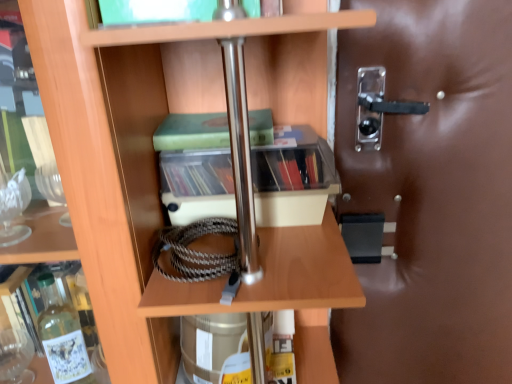
Measure the distance between clear plastic storage at center and camera.

clear plastic storage at center is 29.53 inches from camera.

The height and width of the screenshot is (384, 512). In order to click on clear plastic storage at center in this screenshot , I will do `click(293, 178)`.

Where is `wooden shelf at center`? This screenshot has height=384, width=512. wooden shelf at center is located at coordinates (106, 173).

Where is `transparent plastic handle at right`? This screenshot has height=384, width=512. transparent plastic handle at right is located at coordinates (431, 195).

Is clear plastic storage at center facing towards transparent plastic handle at right?

No, clear plastic storage at center is not turned towards transparent plastic handle at right.

Is clear plastic storage at center shorter than transparent plastic handle at right?

Correct, clear plastic storage at center is not as tall as transparent plastic handle at right.

In terms of width, does clear plastic storage at center look wider or thinner when compared to transparent plastic handle at right?

clear plastic storage at center is wider than transparent plastic handle at right.

Would you say clear plastic storage at center is outside transparent plastic handle at right?

Yes, clear plastic storage at center is outside of transparent plastic handle at right.

Considering the relative sizes of wooden shelf at center and green matte book at center in the image provided, is wooden shelf at center taller than green matte book at center?

Yes, wooden shelf at center is taller than green matte book at center.

Which is farther from the camera, (57, 106) or (225, 127)?

The point (225, 127) is more distant.

From the image's perspective, is wooden shelf at center above or below green matte book at center?

Clearly, from the image's perspective, wooden shelf at center is below green matte book at center.

Does wooden shelf at center appear on the right side of green matte book at center?

In fact, wooden shelf at center is to the left of green matte book at center.

Looking at the image, does transparent plastic handle at right seem bigger or smaller compared to green matte book at center?

transparent plastic handle at right is bigger than green matte book at center.

Where is `paperback book lying in front of the transparent plastic handle at right`? Image resolution: width=512 pixels, height=384 pixels. paperback book lying in front of the transparent plastic handle at right is located at coordinates (192, 132).

Does point (340, 71) come farther from viewer compared to point (221, 120)?

Yes, point (340, 71) is behind point (221, 120).

How different are the orientations of transparent plastic handle at right and green matte book at center in degrees?

The angle between the facing direction of transparent plastic handle at right and the facing direction of green matte book at center is 0.103 degrees.

Which of these two, wooden shelf at center or transparent plastic handle at right, is bigger?

wooden shelf at center.

Locate an element on the screen. shelf above the transparent plastic handle at right (from a real-world perspective) is located at coordinates (106, 173).

Between wooden shelf at center and transparent plastic handle at right, which one appears on the left side from the viewer's perspective?

From the viewer's perspective, wooden shelf at center appears more on the left side.

Is wooden shelf at center taller or shorter than transparent plastic handle at right?

Clearly, wooden shelf at center is shorter compared to transparent plastic handle at right.

Can you tell me how much transparent plastic handle at right and wooden shelf at center differ in facing direction?

0.178 degrees.

Is transparent plastic handle at right facing away from wooden shelf at center?

transparent plastic handle at right is not turned away from wooden shelf at center.

From the image's perspective, which one is positioned higher, transparent plastic handle at right or wooden shelf at center?

transparent plastic handle at right, from the image's perspective.

Is clear plastic storage at center oriented towards green matte book at center?

No, clear plastic storage at center is not facing towards green matte book at center.

Is point (210, 176) behind point (210, 143)?

That is True.

Can you tell me how much clear plastic storage at center and green matte book at center differ in facing direction?

They differ by 0.416 degrees in their facing directions.

Is clear plastic storage at center far away from green matte book at center?

No, clear plastic storage at center is in close proximity to green matte book at center.

Which of these two, wooden shelf at center or clear plastic storage at center, is thinner?

clear plastic storage at center is thinner.

At what (x,y) coordinates should I click in order to perform the action: click on cabinetry behind the wooden shelf at center. Please return your answer as a coordinate pair (x, y). Looking at the image, I should click on (293, 178).

Between wooden shelf at center and clear plastic storage at center, which one has smaller size?

With smaller size is clear plastic storage at center.

This screenshot has width=512, height=384. I want to click on cabinetry on the left of transparent plastic handle at right, so click(x=293, y=178).

At what (x,y) coordinates should I click in order to perform the action: click on shelf lying below the green matte book at center (from the image's perspective). Please return your answer as a coordinate pair (x, y). The height and width of the screenshot is (384, 512). Looking at the image, I should click on (106, 173).

Looking at the image, which one is located further to green matte book at center, transparent plastic handle at right or wooden shelf at center?

Answer: Among the two, transparent plastic handle at right is located further to green matte book at center.

Considering their positions, is transparent plastic handle at right positioned further to clear plastic storage at center than wooden shelf at center?

transparent plastic handle at right lies further to clear plastic storage at center than the other object.

Based on their spatial positions, is clear plastic storage at center or transparent plastic handle at right closer to green matte book at center?

Based on the image, clear plastic storage at center appears to be nearer to green matte book at center.

Considering their positions, is clear plastic storage at center positioned further to transparent plastic handle at right than wooden shelf at center?

wooden shelf at center is positioned further to the anchor transparent plastic handle at right.

Looking at the image, which one is located closer to wooden shelf at center, green matte book at center or transparent plastic handle at right?

green matte book at center is closer to wooden shelf at center.

Which object lies further to the anchor point green matte book at center, transparent plastic handle at right or clear plastic storage at center?

Among the two, transparent plastic handle at right is located further to green matte book at center.

Which object lies nearer to the anchor point wooden shelf at center, clear plastic storage at center or transparent plastic handle at right?

clear plastic storage at center.

From the image, which object appears to be nearer to transparent plastic handle at right, clear plastic storage at center or green matte book at center?

Based on the image, clear plastic storage at center appears to be nearer to transparent plastic handle at right.

Locate an element on the screen. paperback book situated between wooden shelf at center and transparent plastic handle at right from left to right is located at coordinates (192, 132).

Where is `cabinetry located between green matte book at center and transparent plastic handle at right in the left-right direction`? The height and width of the screenshot is (384, 512). cabinetry located between green matte book at center and transparent plastic handle at right in the left-right direction is located at coordinates (293, 178).

Where is `cabinetry between wooden shelf at center and transparent plastic handle at right in the horizontal direction`? cabinetry between wooden shelf at center and transparent plastic handle at right in the horizontal direction is located at coordinates (293, 178).

Image resolution: width=512 pixels, height=384 pixels. Identify the location of paperback book positioned between wooden shelf at center and clear plastic storage at center from near to far. (192, 132).